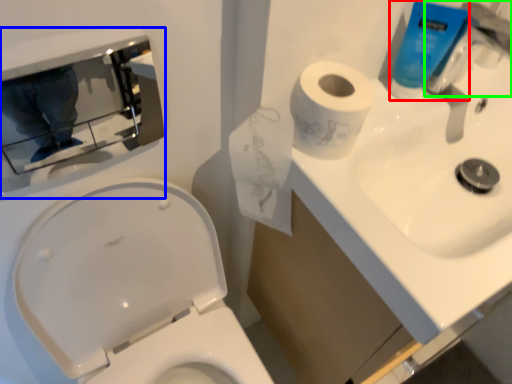
Question: Which object is the farthest from cleaning product (highlighted by a red box)? Choose among these: medicine cabinet (highlighted by a blue box) or faucet (highlighted by a green box).

Choices:
 (A) medicine cabinet
 (B) faucet

Answer: (A)